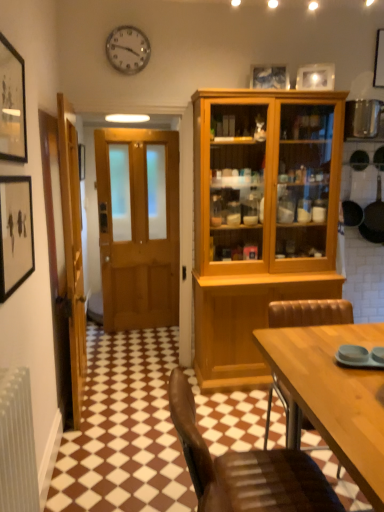
Identify the location of free spot above brown wooden door at center, the 1th door in the right-to-left sequence (from a real-world perspective). Image resolution: width=384 pixels, height=512 pixels. (134, 92).